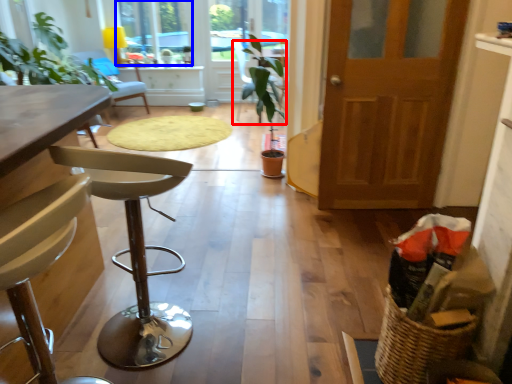
Question: Which of the following is the closest to the observer, chair (highlighted by a red box) or window (highlighted by a blue box)?

Choices:
 (A) chair
 (B) window

Answer: (A)